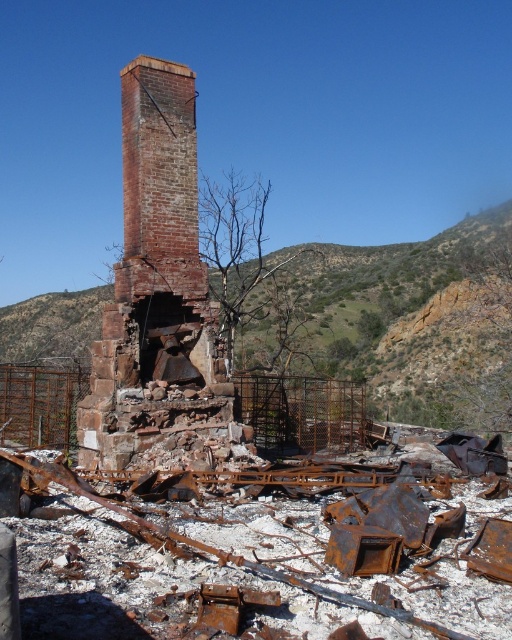
Is rusty metal hillside at center shorter than rusty brick chimney at center?

No, rusty metal hillside at center is not shorter than rusty brick chimney at center.

Does rusty metal hillside at center appear on the right side of rusty brick chimney at center?

Yes, rusty metal hillside at center is to the right of rusty brick chimney at center.

Is point (242, 342) more distant than point (187, 385)?

That is True.

Where is `rusty metal hillside at center`? Image resolution: width=512 pixels, height=640 pixels. rusty metal hillside at center is located at coordinates (399, 317).